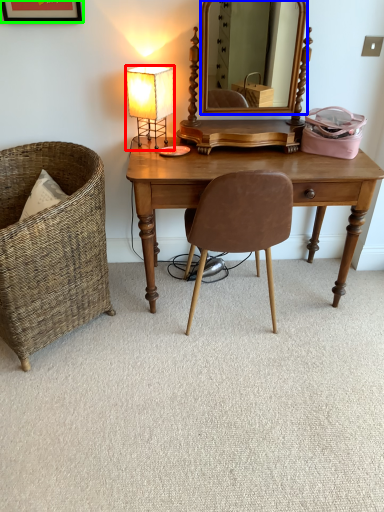
Question: Which object is the farthest from lamp (highlighted by a red box)? Choose among these: mirror (highlighted by a blue box) or picture frame (highlighted by a green box).

Choices:
 (A) mirror
 (B) picture frame

Answer: (A)